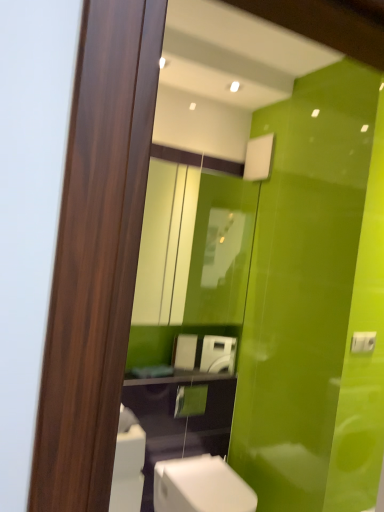
Identify the location of matte glass mirror at upper center. (189, 249).

In order to click on white glossy washing machine at center in this screenshot , I will do `click(218, 354)`.

Locate an element on the screen. This screenshot has height=512, width=384. matte glass mirror at upper center is located at coordinates (189, 249).

Which of these two, white glossy toilet at lower center or matte glass mirror at upper center, is bigger?

With larger size is matte glass mirror at upper center.

Is white glossy toilet at lower center looking in the opposite direction of matte glass mirror at upper center?

No.

Considering their positions, is white glossy toilet at lower center located in front of or behind matte glass mirror at upper center?

Visually, white glossy toilet at lower center is located in front of matte glass mirror at upper center.

Does white glossy toilet at lower center have a greater width compared to matte glass mirror at upper center?

Yes.

Does white glossy toilet at lower center lie behind white glossy washing machine at center?

No, the depth of white glossy toilet at lower center is less than that of white glossy washing machine at center.

Considering the relative positions of white glossy toilet at lower center and white glossy washing machine at center in the image provided, is white glossy toilet at lower center to the right of white glossy washing machine at center from the viewer's perspective?

No, white glossy toilet at lower center is not to the right of white glossy washing machine at center.

In order to click on toilet below the white glossy washing machine at center (from a real-world perspective) in this screenshot , I will do `click(200, 486)`.

Which is more to the right, white glossy washing machine at center or white glossy toilet at lower center?

white glossy washing machine at center.

Does white glossy washing machine at center have a lesser width compared to white glossy toilet at lower center?

Correct, the width of white glossy washing machine at center is less than that of white glossy toilet at lower center.

Is white glossy washing machine at center further to the viewer compared to white glossy toilet at lower center?

That is True.

Is white glossy washing machine at center beside white glossy toilet at lower center?

They are not placed beside each other.

How many degrees apart are the facing directions of white glossy washing machine at center and matte glass mirror at upper center?

There is a 23.5-degree angle between the facing directions of white glossy washing machine at center and matte glass mirror at upper center.

Consider the image. From the image's perspective, is white glossy washing machine at center positioned above or below matte glass mirror at upper center?

white glossy washing machine at center is below matte glass mirror at upper center.

Could you tell me if white glossy washing machine at center is facing matte glass mirror at upper center?

No, white glossy washing machine at center does not turn towards matte glass mirror at upper center.

Considering the relative sizes of white glossy washing machine at center and matte glass mirror at upper center in the image provided, is white glossy washing machine at center smaller than matte glass mirror at upper center?

Indeed, white glossy washing machine at center has a smaller size compared to matte glass mirror at upper center.

From the image's perspective, is matte glass mirror at upper center over white glossy washing machine at center?

Yes, from the image's perspective, matte glass mirror at upper center is above white glossy washing machine at center.

Would you say matte glass mirror at upper center is a long distance from white glossy washing machine at center?

No.

Do you think matte glass mirror at upper center is within white glossy washing machine at center, or outside of it?

matte glass mirror at upper center is spatially situated outside white glossy washing machine at center.

Which object is thinner, matte glass mirror at upper center or white glossy washing machine at center?

With smaller width is white glossy washing machine at center.

Which object is positioned more to the right, matte glass mirror at upper center or white glossy toilet at lower center?

white glossy toilet at lower center is more to the right.

From the image's perspective, which object appears higher, matte glass mirror at upper center or white glossy toilet at lower center?

matte glass mirror at upper center appears higher in the image.

Considering the relative sizes of matte glass mirror at upper center and white glossy toilet at lower center in the image provided, is matte glass mirror at upper center wider than white glossy toilet at lower center?

No, matte glass mirror at upper center is not wider than white glossy toilet at lower center.

From a real-world perspective, is matte glass mirror at upper center positioned above or below white glossy toilet at lower center?

matte glass mirror at upper center is above white glossy toilet at lower center.

Locate an element on the screen. The height and width of the screenshot is (512, 384). toilet that appears on the right of matte glass mirror at upper center is located at coordinates (200, 486).

Identify the location of toilet below the white glossy washing machine at center (from the image's perspective). This screenshot has height=512, width=384. (200, 486).

Considering their positions, is matte glass mirror at upper center positioned further to white glossy toilet at lower center than white glossy washing machine at center?

matte glass mirror at upper center is further to white glossy toilet at lower center.

From the image, which object appears to be nearer to white glossy washing machine at center, matte glass mirror at upper center or white glossy toilet at lower center?

Based on the image, matte glass mirror at upper center appears to be nearer to white glossy washing machine at center.

Based on their spatial positions, is white glossy washing machine at center or white glossy toilet at lower center further from matte glass mirror at upper center?

white glossy toilet at lower center lies further to matte glass mirror at upper center than the other object.

Looking at the image, which one is located closer to white glossy washing machine at center, white glossy toilet at lower center or matte glass mirror at upper center?

The object closer to white glossy washing machine at center is matte glass mirror at upper center.

In the scene shown: Looking at the image, which one is located closer to matte glass mirror at upper center, white glossy toilet at lower center or white glossy washing machine at center?

white glossy washing machine at center is positioned closer to the anchor matte glass mirror at upper center.

Looking at the image, which one is located closer to white glossy toilet at lower center, white glossy washing machine at center or matte glass mirror at upper center?

Among the two, white glossy washing machine at center is located nearer to white glossy toilet at lower center.

The height and width of the screenshot is (512, 384). In order to click on appliance that lies between matte glass mirror at upper center and white glossy toilet at lower center from top to bottom in this screenshot , I will do `click(218, 354)`.